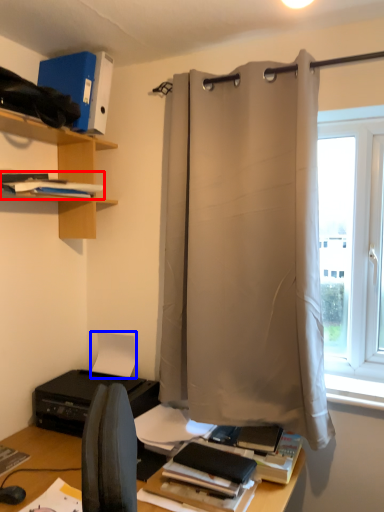
Question: Among these objects, which one is nearest to the camera, book (highlighted by a red box) or paper (highlighted by a blue box)?

Choices:
 (A) book
 (B) paper

Answer: (A)